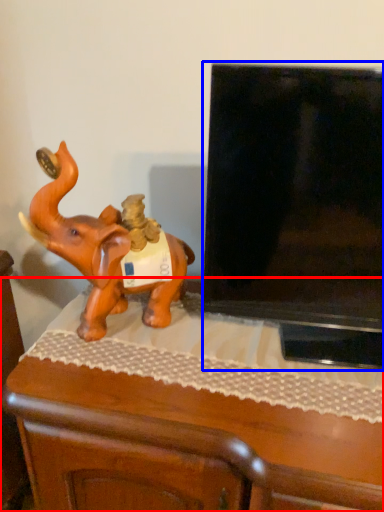
Question: Among these objects, which one is nearest to the camera, furniture (highlighted by a red box) or television (highlighted by a blue box)?

Choices:
 (A) furniture
 (B) television

Answer: (B)